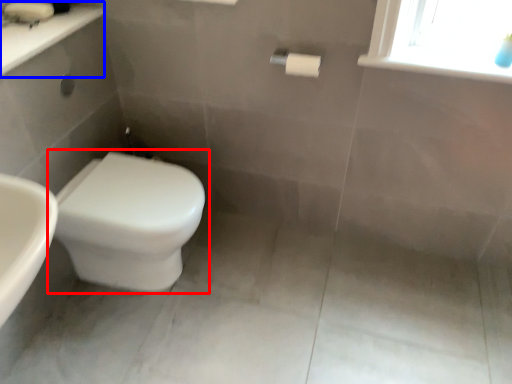
Question: Which object is further to the camera taking this photo, toilet (highlighted by a red box) or counter top (highlighted by a blue box)?

Choices:
 (A) toilet
 (B) counter top

Answer: (A)